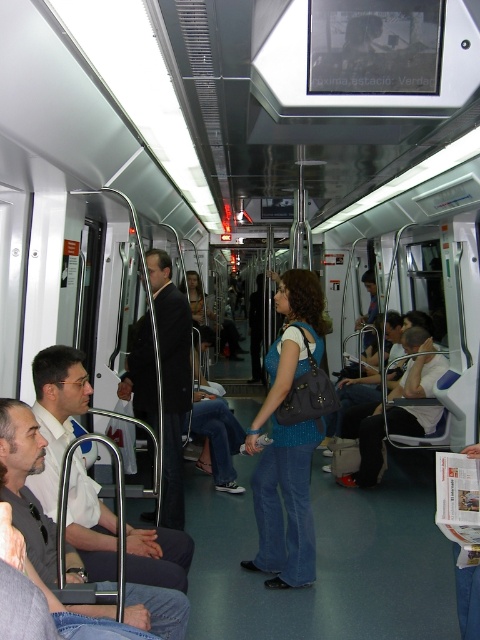
You are a passenger on the subway train and you see a person wearing a knitted blue sweater at center and another wearing a white shirt at left. Which clothing item is located to the right of the other?

The knitted blue sweater at center is positioned on the right side of white shirt at left.

You are a passenger on the subway train and want to check if the knitted blue sweater at center is visible from above the black suit coat at center. Based on their positions, can you see it?

The knitted blue sweater at center is positioned under the black suit coat at center, so it is not visible from above the black suit coat at center.